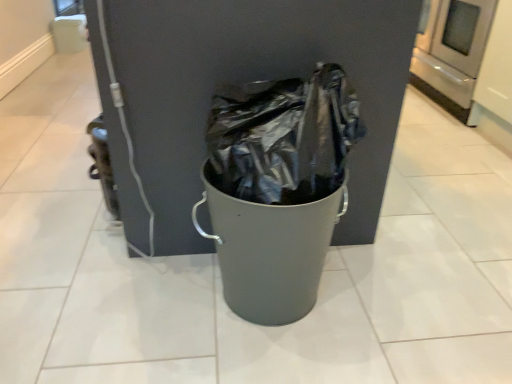
What do you see at coordinates (452, 52) in the screenshot?
I see `satin stainless steel oven at upper right` at bounding box center [452, 52].

Image resolution: width=512 pixels, height=384 pixels. What are the coordinates of `satin stainless steel oven at upper right` in the screenshot? It's located at (452, 52).

Where is `satin stainless steel oven at upper right`? satin stainless steel oven at upper right is located at coordinates (452, 52).